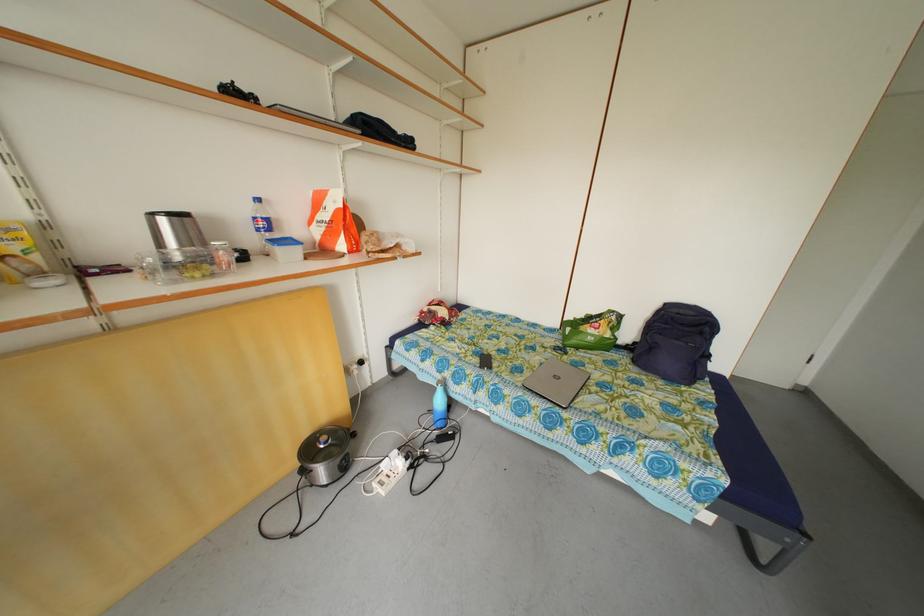
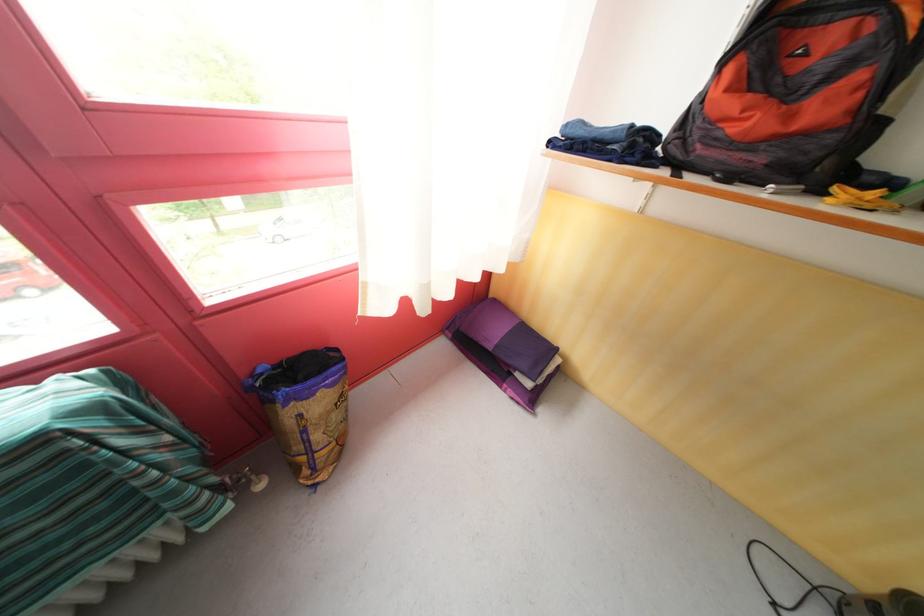
How did the camera likely rotate?

The camera's rotation is toward left-down.